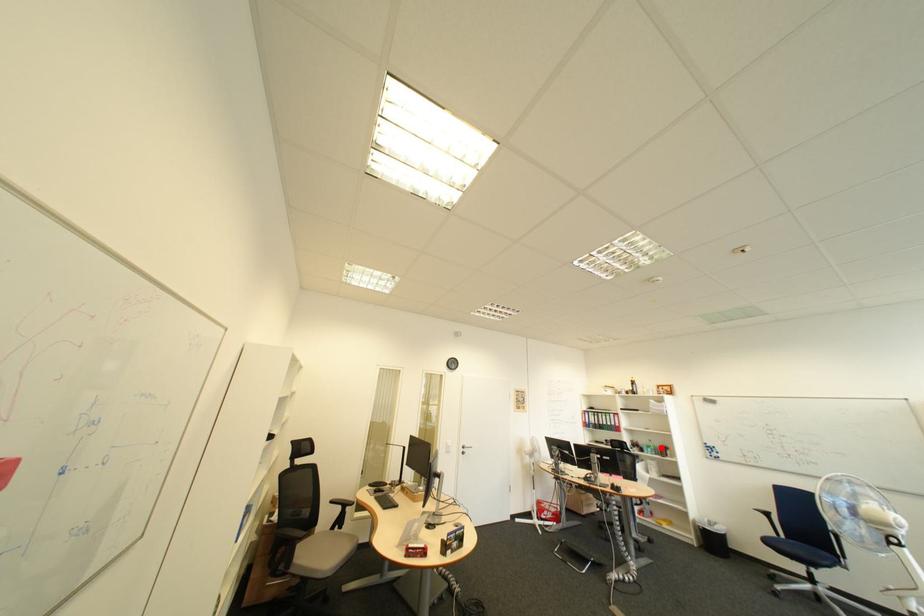
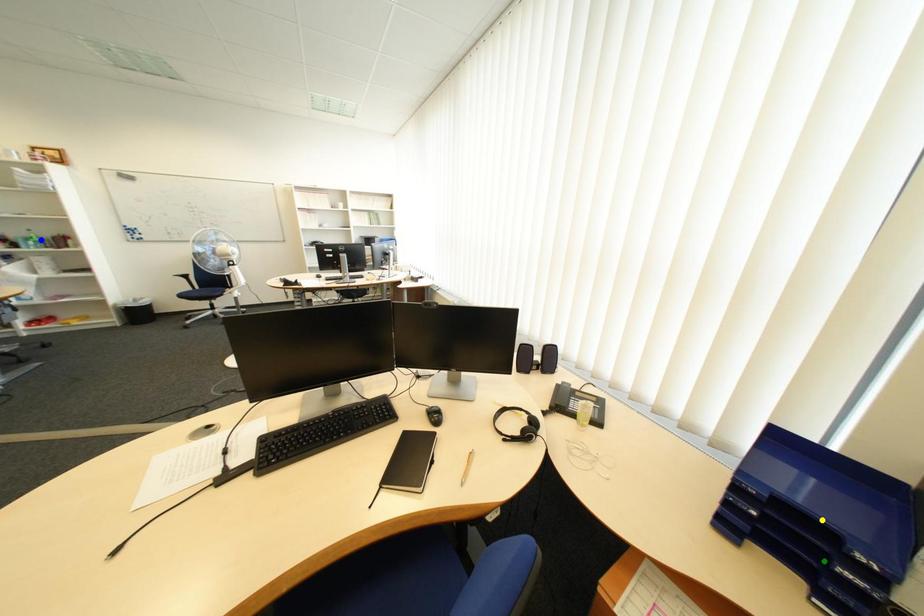
Question: I am providing you with two images of the same scene from different viewpoints. A red point is marked on the first image. You are given multiple points on the second image. In image 2, which mark is for the same physical point as the one in image 1?

Choices:
 (A) blue point
 (B) green point
 (C) yellow point

Answer: (A)